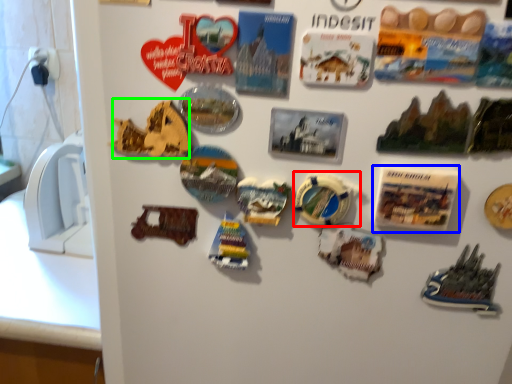
Question: Considering the real-world distances, which object is closest to stuff (highlighted by a red box)? postcard (highlighted by a blue box) or stuff (highlighted by a green box).

Choices:
 (A) postcard
 (B) stuff

Answer: (A)